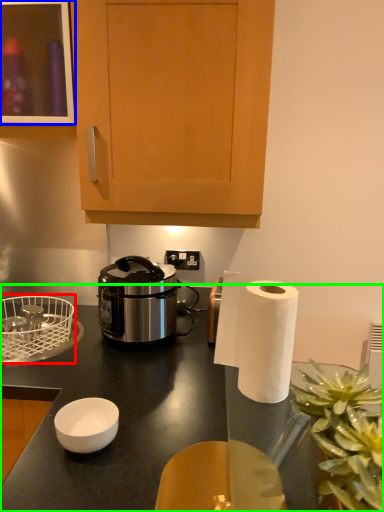
Question: Estimate the real-world distances between objects in this image. Which object is farther from basket (highlighted by a red box), cabinetry (highlighted by a blue box) or desk (highlighted by a green box)?

Choices:
 (A) cabinetry
 (B) desk

Answer: (A)